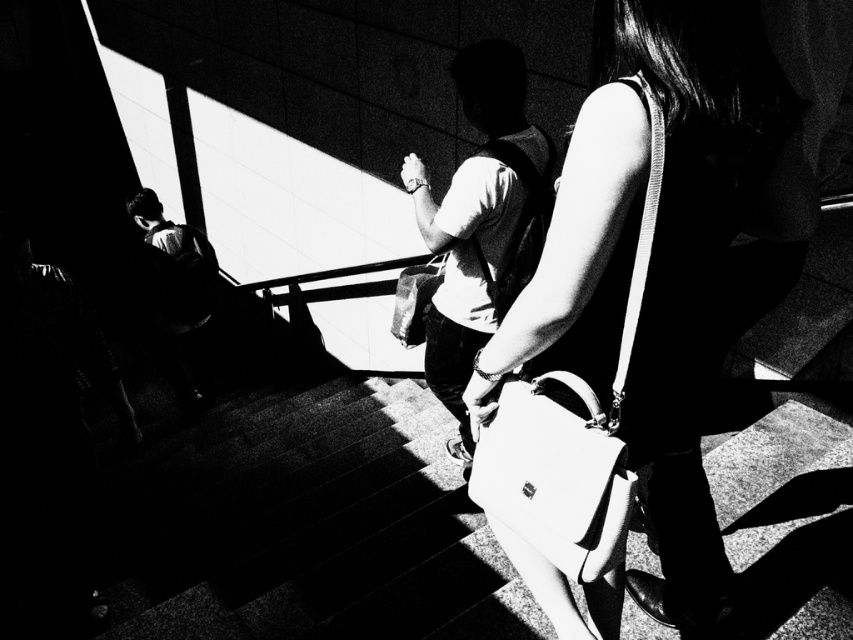
You are a photographer analyzing the composition of this black and white photo. You notice the white leather handbag at center and the dark fabric backpack at left. Which object is shorter in height?

The white leather handbag at center is not as tall as the dark fabric backpack at left, so the white leather handbag at center is shorter in height.

You are a photographer analyzing the composition of this black and white photo. The main focus is on two people climbing stairs. You need to determine the exact location of the white leather handbag at center in the frame. What are its coordinates?

The white leather handbag at center is located at coordinates point (556, 476).

You are a photographer analyzing this urban scene. You need to determine which object is nearer to the camera between the matte white handbag at center and the dark fabric backpack at left. Based on the spatial arrangement in the image, which one is closer?

The matte white handbag at center is closer to the viewer than the dark fabric backpack at left, so the matte white handbag at center is nearer to the camera.